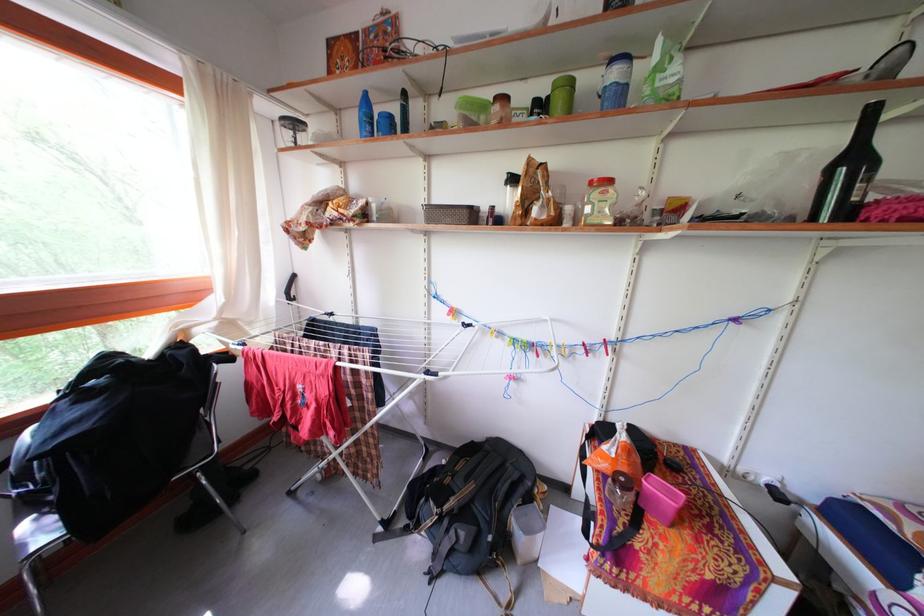
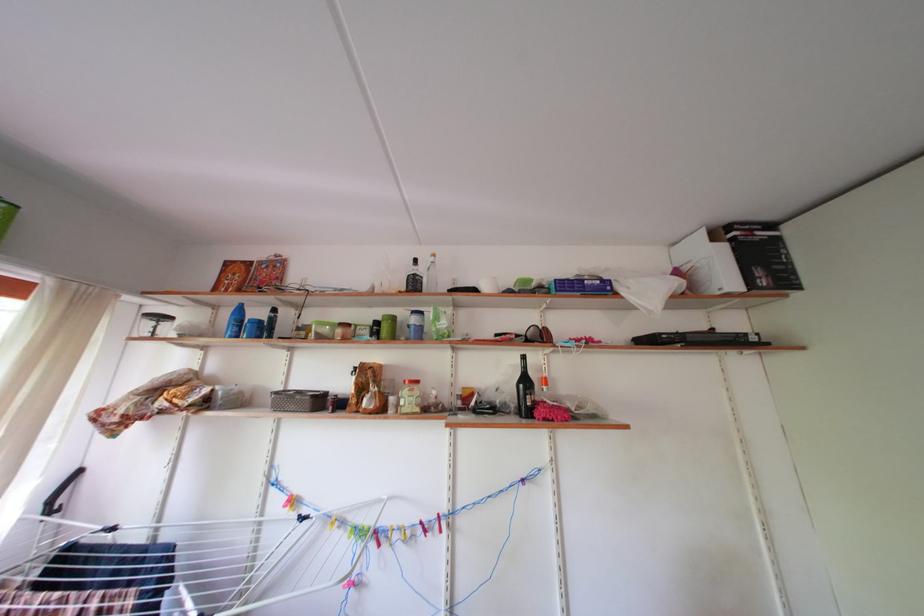
The point at (861, 166) is marked in the first image. Where is the corresponding point in the second image?

(533, 387)